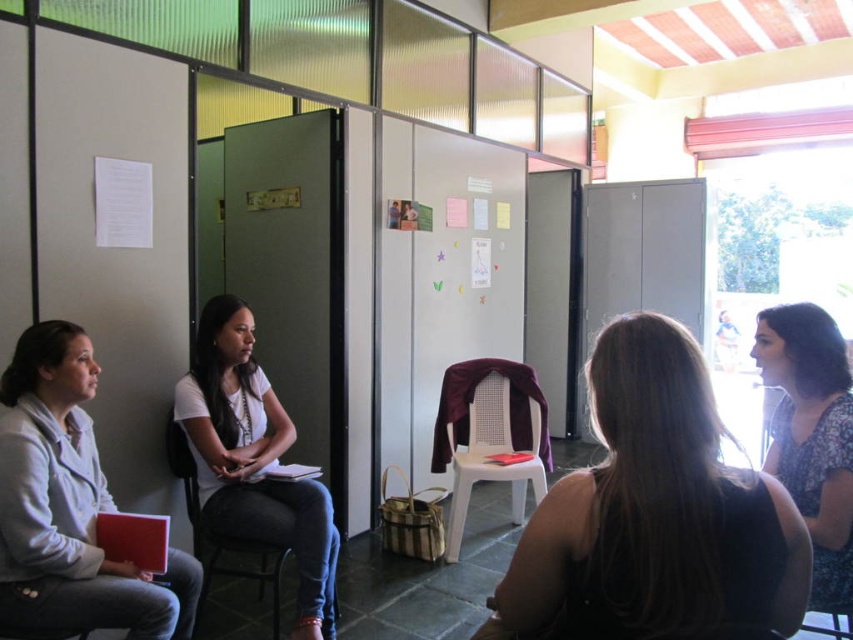
You are standing in the room and want to reach both the point at coordinates (824,499) and the point at coordinates (193,541). Which coordinate point will you reach first if you move straight towards them?

Point at coordinates (824,499) will be reached first because it is closer to you than point at coordinates (193,541).

You are a visitor entering the room and need to locate the person with dark brown hair at center. Which direction should you look relative to the floral dress at right?

The dark brown hair at center is in front of the floral dress at right, so you should look towards the center from the floral dress at right to find the person with dark brown hair.

You are a person entering the room and need to sit down. You see a dark brown hair at center and a black plastic chair at center. Which one is narrower so you can sit quickly?

The dark brown hair at center is narrower than the black plastic chair at center, so you can sit quickly there.